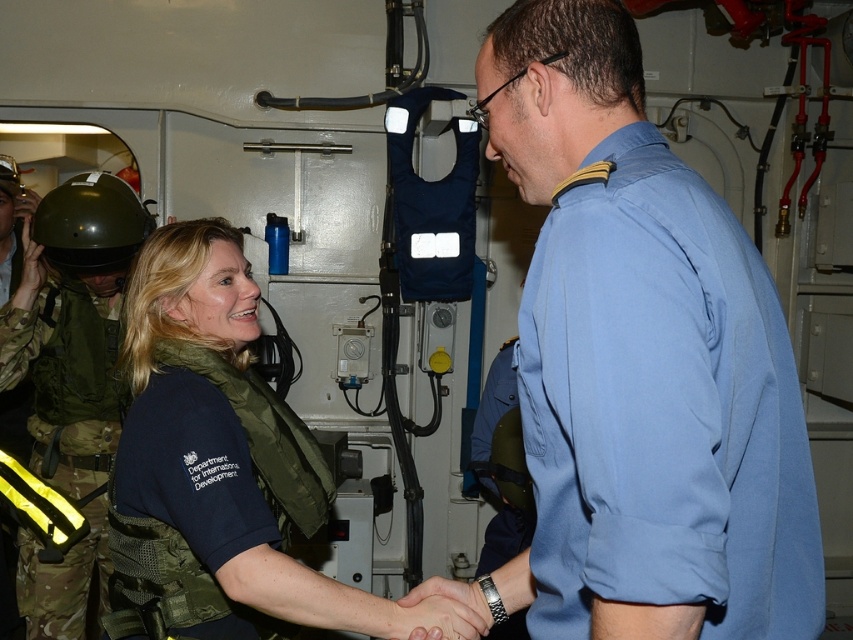
Question: Which object is farther from the camera taking this photo?

Choices:
 (A) dark blue fabric vest at center
 (B) green matte helmet at left

Answer: (B)

Question: Observing the image, what is the correct spatial positioning of blue cotton shirt at right in reference to dark blue fabric vest at center?

Choices:
 (A) above
 (B) below

Answer: (A)

Question: Based on their relative distances, which object is nearer to the green matte helmet at left?

Choices:
 (A) dark blue fabric vest at center
 (B) blue cotton shirt at right
 (C) navy blue shirt at center

Answer: (C)

Question: Does blue cotton shirt at right appear over dark blue fabric vest at center?

Choices:
 (A) no
 (B) yes

Answer: (B)

Question: Estimate the real-world distances between objects in this image. Which object is closer to the dark blue fabric vest at center?

Choices:
 (A) green matte helmet at left
 (B) blue cotton shirt at right

Answer: (B)

Question: Does blue cotton shirt at right appear on the left side of green matte helmet at left?

Choices:
 (A) yes
 (B) no

Answer: (B)